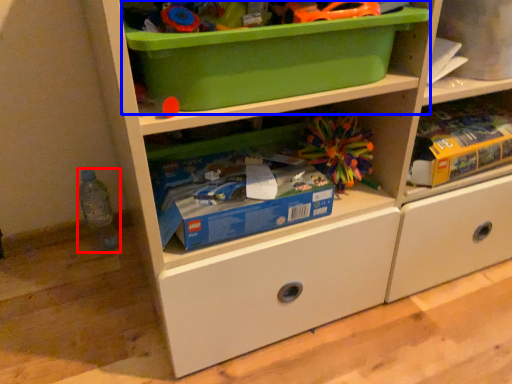
Question: Which of the following is the closest to the observer, bottle (highlighted by a red box) or storage box (highlighted by a blue box)?

Choices:
 (A) bottle
 (B) storage box

Answer: (B)